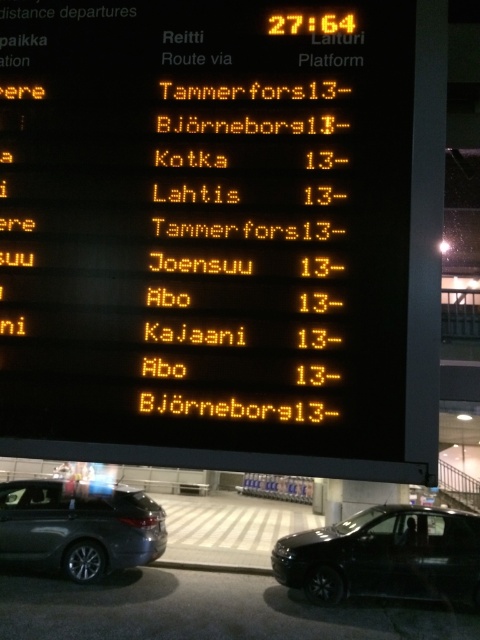
Who is positioned more to the right, yellow led display at center or black glossy car at lower right?

black glossy car at lower right is more to the right.

Between yellow led display at center and black glossy car at lower right, which one appears on the left side from the viewer's perspective?

Positioned to the left is yellow led display at center.

Which is in front, point (361, 148) or point (280, 554)?

Point (361, 148) is in front.

At what (x,y) coordinates should I click in order to perform the action: click on yellow led display at center. Please return your answer as a coordinate pair (x, y). Looking at the image, I should click on (207, 234).

Does yellow led display at center appear on the right side of metallic gray sedan at lower left?

Indeed, yellow led display at center is positioned on the right side of metallic gray sedan at lower left.

Which is behind, point (240, 92) or point (47, 513)?

Positioned behind is point (47, 513).

Between point (319, 250) and point (153, 556), which one is positioned behind?

Positioned behind is point (153, 556).

Locate an element on the screen. The height and width of the screenshot is (640, 480). yellow led display at center is located at coordinates (207, 234).

Does black glossy car at lower right have a smaller size compared to metallic gray sedan at lower left?

No, black glossy car at lower right is not smaller than metallic gray sedan at lower left.

Between point (408, 512) and point (113, 557), which one is positioned behind?

Positioned behind is point (408, 512).

Is point (342, 580) positioned after point (147, 502)?

No, (342, 580) is in front of (147, 502).

This screenshot has width=480, height=640. Identify the location of black glossy car at lower right. (384, 556).